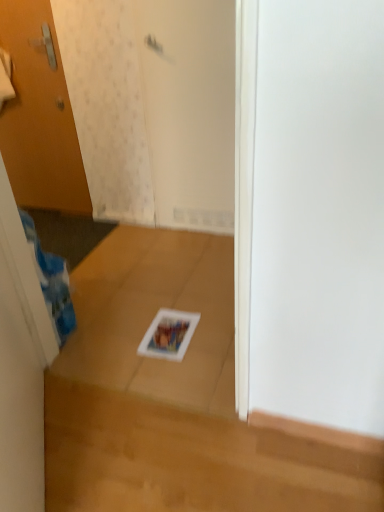
Question: From a real-world perspective, is wooden door at left positioned over white matte screen door at upper center based on gravity?

Choices:
 (A) no
 (B) yes

Answer: (B)

Question: Does wooden door at left turn towards white matte screen door at upper center?

Choices:
 (A) no
 (B) yes

Answer: (A)

Question: Is wooden door at left smaller than white matte screen door at upper center?

Choices:
 (A) yes
 (B) no

Answer: (A)

Question: From a real-world perspective, is wooden door at left under white matte screen door at upper center?

Choices:
 (A) yes
 (B) no

Answer: (B)

Question: From the image's perspective, is wooden door at left on white matte screen door at upper center?

Choices:
 (A) yes
 (B) no

Answer: (A)

Question: Considering their positions, is wooden door at left located in front of or behind white matte screen door at upper center?

Choices:
 (A) behind
 (B) front

Answer: (A)

Question: Is wooden door at left wider or thinner than white matte screen door at upper center?

Choices:
 (A) wide
 (B) thin

Answer: (B)

Question: From their relative heights in the image, would you say wooden door at left is taller or shorter than white matte screen door at upper center?

Choices:
 (A) short
 (B) tall

Answer: (B)

Question: Is wooden door at left spatially inside white matte screen door at upper center, or outside of it?

Choices:
 (A) inside
 (B) outside

Answer: (B)

Question: Is matte white magazine at center spatially inside wooden door at left, or outside of it?

Choices:
 (A) inside
 (B) outside

Answer: (B)

Question: From a real-world perspective, is matte white magazine at center physically located above or below wooden door at left?

Choices:
 (A) above
 (B) below

Answer: (B)

Question: In terms of height, does matte white magazine at center look taller or shorter compared to wooden door at left?

Choices:
 (A) short
 (B) tall

Answer: (A)

Question: Based on their positions, is matte white magazine at center located to the left or right of wooden door at left?

Choices:
 (A) left
 (B) right

Answer: (B)

Question: Is white matte screen door at upper center in front of or behind wooden door at left in the image?

Choices:
 (A) front
 (B) behind

Answer: (A)

Question: Is point (203, 139) closer or farther from the camera than point (41, 200)?

Choices:
 (A) closer
 (B) farther

Answer: (A)